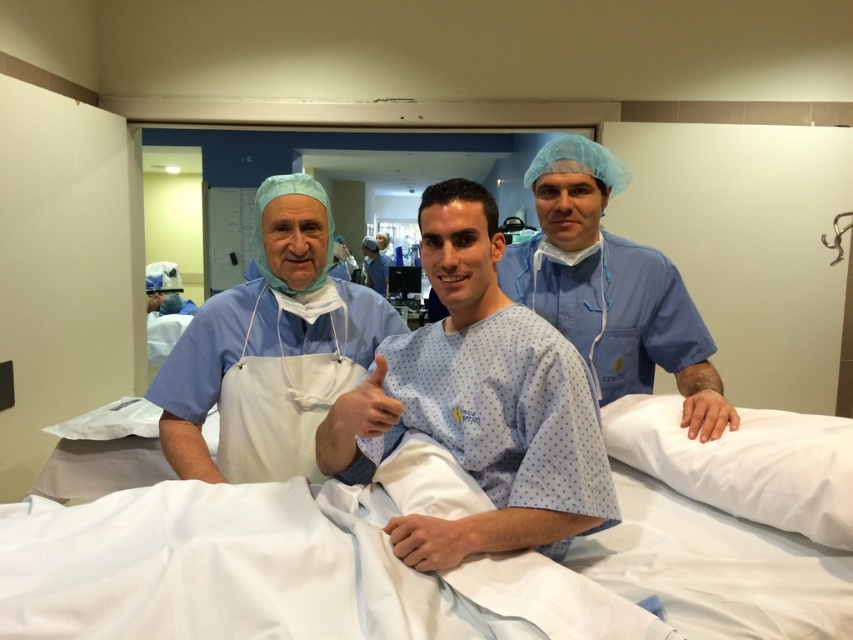
Question: Does blue fabric hospital gown at center appear over blue smooth scrubs at right?

Choices:
 (A) yes
 (B) no

Answer: (B)

Question: Which object is farther from the camera taking this photo?

Choices:
 (A) blue smooth scrubs at right
 (B) white matte apron at center
 (C) blue surgical gown at center

Answer: (C)

Question: Does white fabric bed at center appear over blue smooth scrubs at right?

Choices:
 (A) yes
 (B) no

Answer: (B)

Question: Considering the real-world distances, which object is farthest from the blue surgical gown at center?

Choices:
 (A) blue smooth scrubs at right
 (B) blue fabric hospital gown at center
 (C) white fabric bed at center

Answer: (C)

Question: Does blue fabric hospital gown at center appear under white matte apron at center?

Choices:
 (A) yes
 (B) no

Answer: (A)

Question: Which object appears farthest from the camera in this image?

Choices:
 (A) blue smooth scrubs at right
 (B) blue fabric hospital gown at center

Answer: (A)